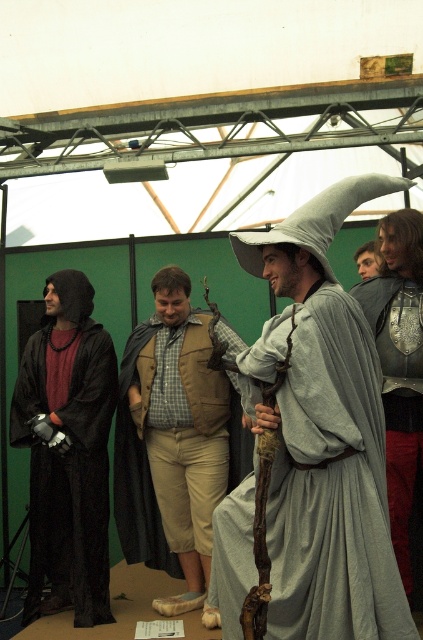
Does point (90, 580) lie behind point (412, 365)?

Yes, it is behind point (412, 365).

Based on the photo, can you confirm if matte black robe at left is positioned to the left of metallic silver armor at right?

Indeed, matte black robe at left is positioned on the left side of metallic silver armor at right.

Which is behind, point (32, 609) or point (387, 285)?

The point (32, 609) is more distant.

Find the location of a particular element. matte black robe at left is located at coordinates (68, 451).

Is point (285, 472) positioned before point (382, 246)?

Yes.

Who is taller, gray fabric wizard hat at center or metallic silver armor at right?

With more height is metallic silver armor at right.

Measure the distance between point (326, 278) and camera.

They are 3.22 meters apart.

Locate an element on the screen. The image size is (423, 640). gray fabric wizard hat at center is located at coordinates tap(327, 438).

Can you confirm if gray fabric wizard hat at center is positioned below tan suede vest at center?

No.

Who is more distant from viewer, (233, 547) or (202, 550)?

Positioned behind is point (202, 550).

Is point (304, 417) closer to camera compared to point (208, 413)?

Yes.

Find the location of a particular element. The height and width of the screenshot is (640, 423). gray fabric wizard hat at center is located at coordinates (327, 438).